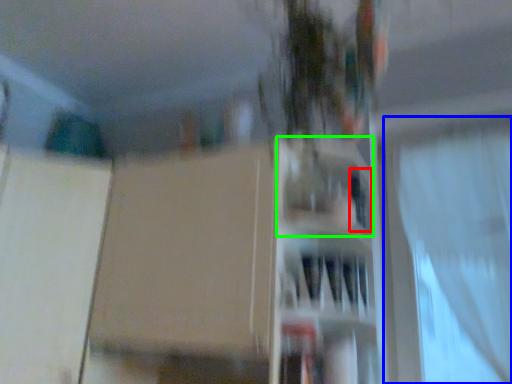
Question: Which object is positioned farthest from window (highlighted by a red box)? Select from curtain (highlighted by a blue box) and shelf (highlighted by a green box).

Choices:
 (A) curtain
 (B) shelf

Answer: (A)